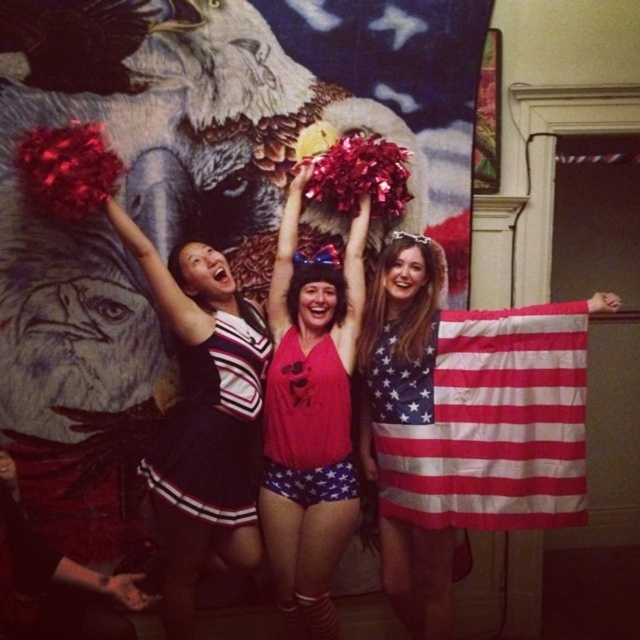
Question: Where is matte red halter top at center located in relation to american flag dress at center in the image?

Choices:
 (A) right
 (B) left

Answer: (B)

Question: Which point is closer to the camera?

Choices:
 (A) american flag at center
 (B) red fabric dress at center
 (C) matte red halter top at center

Answer: (A)

Question: Can you confirm if american flag at center is bigger than black jersey at center?

Choices:
 (A) no
 (B) yes

Answer: (A)

Question: Among these objects, which one is nearest to the camera?

Choices:
 (A) velvet cheerleading outfit at center
 (B) black jersey at center
 (C) american flag at center

Answer: (A)

Question: Which point is closer to the camera?

Choices:
 (A) (378, 448)
 (B) (225, 333)
 (C) (352, 282)

Answer: (B)

Question: Can you confirm if matte red halter top at center is positioned to the left of velvet cheerleading outfit at center?

Choices:
 (A) yes
 (B) no

Answer: (B)